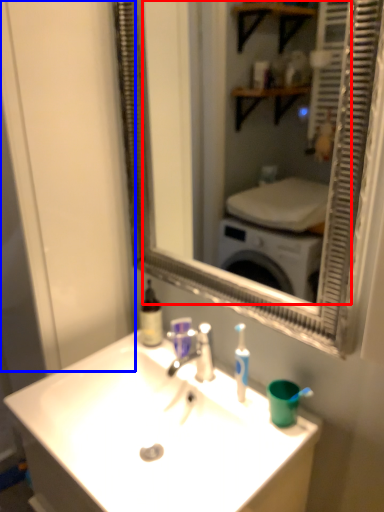
Question: Among these objects, which one is farthest to the camera, mirror (highlighted by a red box) or glass door (highlighted by a blue box)?

Choices:
 (A) mirror
 (B) glass door

Answer: (B)